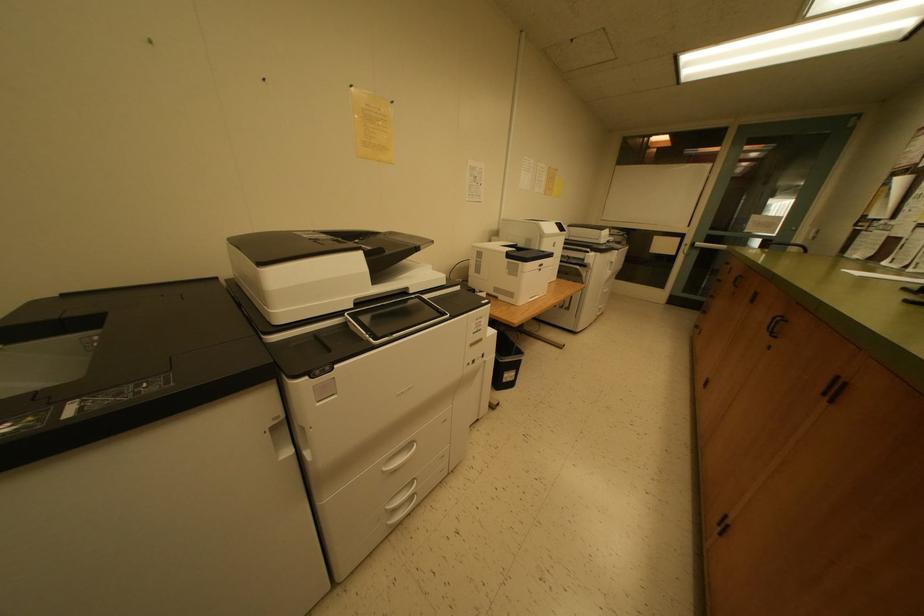
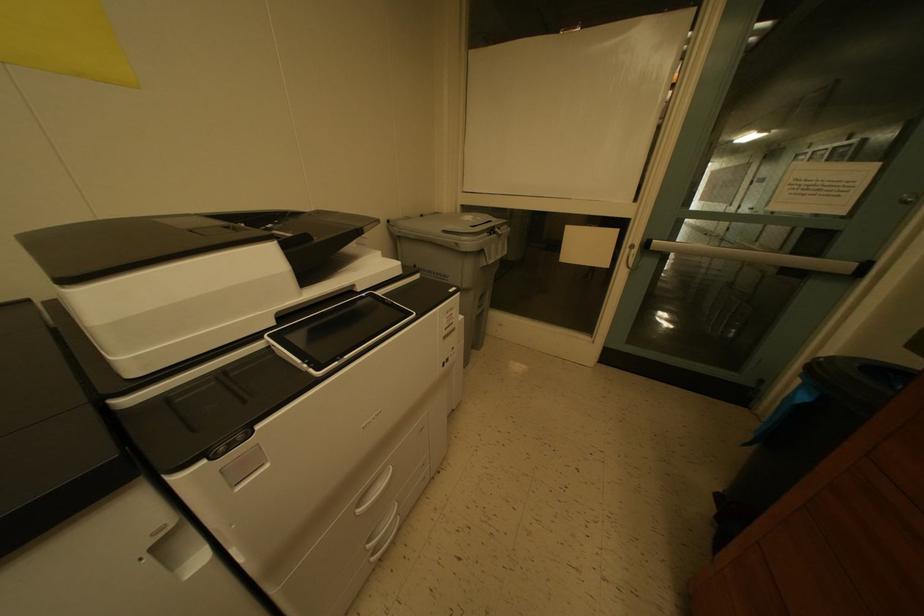
What movement of the cameraman would produce the second image?

The movement direction of the cameraman is right, forward.